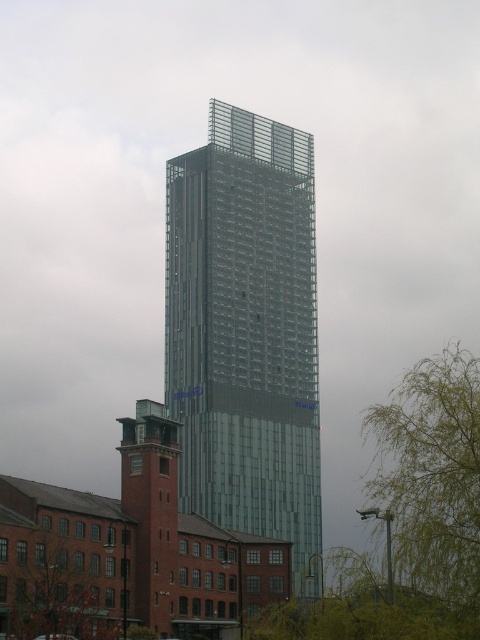
Is green leafy tree at center thinner than green leafy tree at lower left?

No, green leafy tree at center is not thinner than green leafy tree at lower left.

Between green leafy tree at center and green leafy tree at lower left, which one is positioned higher?

green leafy tree at center

The image size is (480, 640). What do you see at coordinates (409, 518) in the screenshot?
I see `green leafy tree at center` at bounding box center [409, 518].

This screenshot has height=640, width=480. In order to click on green leafy tree at center in this screenshot , I will do `click(409, 518)`.

Is transparent glass tower at center below green leafy tree at center?

Actually, transparent glass tower at center is above green leafy tree at center.

Between point (180, 364) and point (408, 481), which one is positioned in front?

Point (408, 481)

Identify the location of transparent glass tower at center. This screenshot has height=640, width=480. (245, 332).

At what (x,y) coordinates should I click in order to perform the action: click on transparent glass tower at center. Please return your answer as a coordinate pair (x, y). The height and width of the screenshot is (640, 480). Looking at the image, I should click on (245, 332).

Does point (242, 432) come behind point (76, 620)?

Yes, it is behind point (76, 620).

Is point (289, 237) positioned before point (48, 611)?

No.

Find the location of a particular element. The image size is (480, 640). transparent glass tower at center is located at coordinates (245, 332).